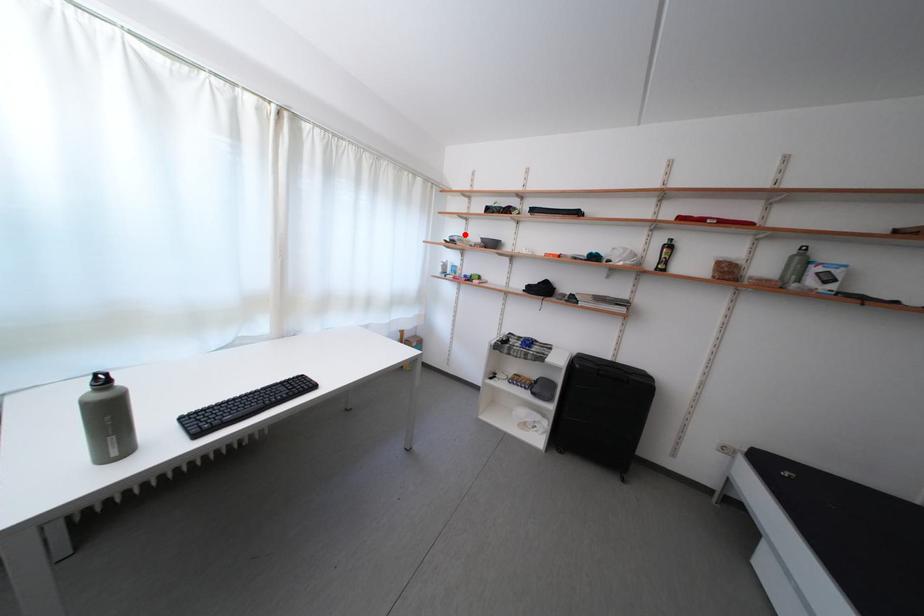
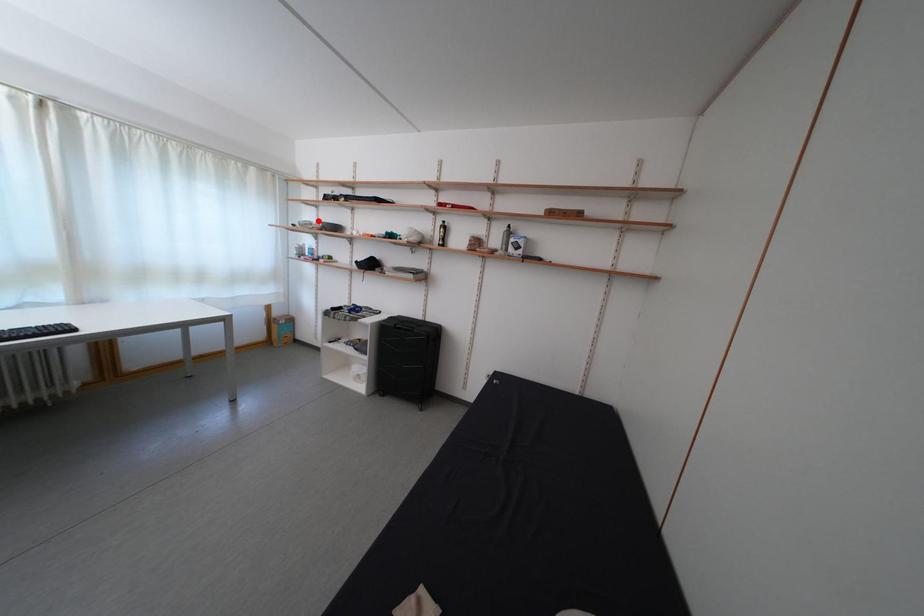
I am providing you with two images of the same scene from different viewpoints. A red point is marked on the first image and another point is marked on the second image. Is the marked point in image1 the same physical position as the marked point in image2?

Yes